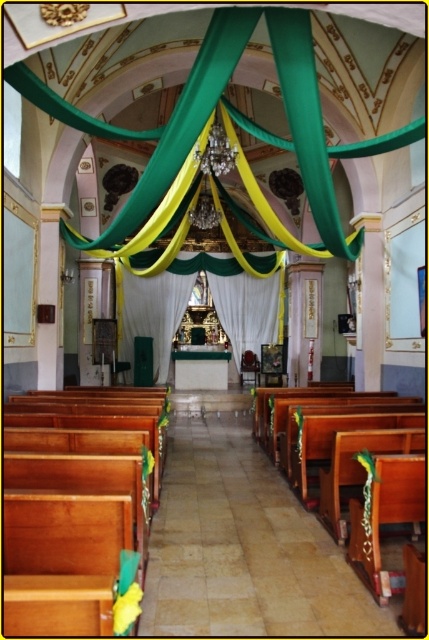
You are a photographer planning to take a wide shot of the church interior. You need to ensure that both the wooden pews at center and the white sheer curtain at center are fully visible in the frame. Given their widths, which object will require you to adjust your camera angle more to capture its full width?

The wooden pews at center has a lesser width compared to the white sheer curtain at center, so you will need to adjust your camera angle more to capture the full width of the white sheer curtain at center.

You are standing at the entrance of the church and want to find the wooden pews at center. According to the coordinates provided, where should you look to locate them?

The wooden pews at center are located at coordinates point (242,547), which means they are positioned towards the right side of the church near the center.